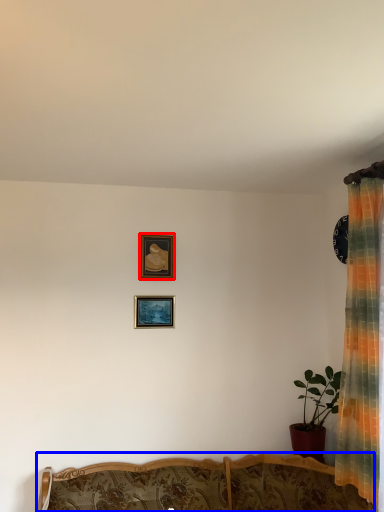
Question: Which object appears farthest to the camera in this image, picture frame (highlighted by a red box) or furniture (highlighted by a blue box)?

Choices:
 (A) picture frame
 (B) furniture

Answer: (A)